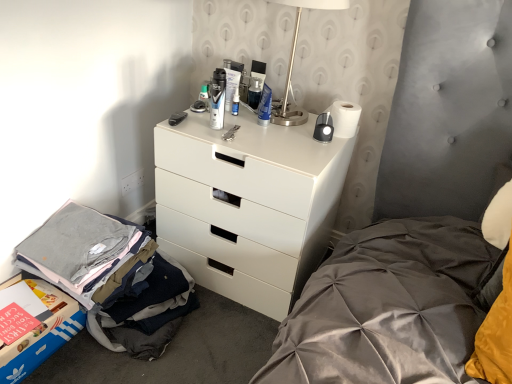
Locate an element on the screen. The height and width of the screenshot is (384, 512). free area behind blue plastic tube at center, positioned as the 5th toiletry in left-to-right order is located at coordinates (270, 112).